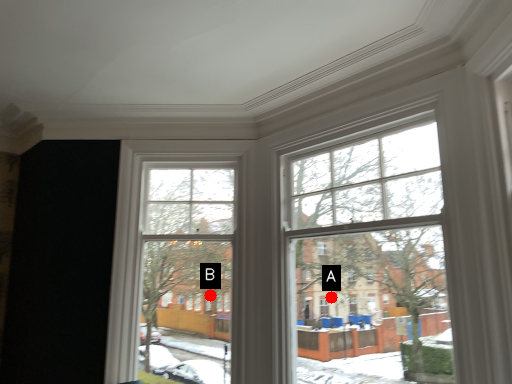
Question: Two points are circled on the image, labeled by A and B beside each circle. Which point is closer to the camera?

Choices:
 (A) A is closer
 (B) B is closer

Answer: (A)